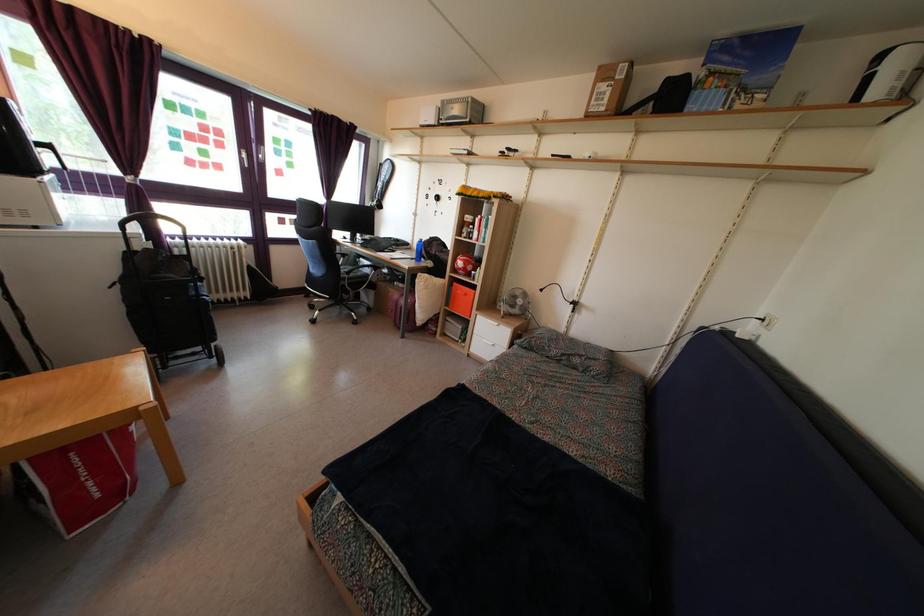
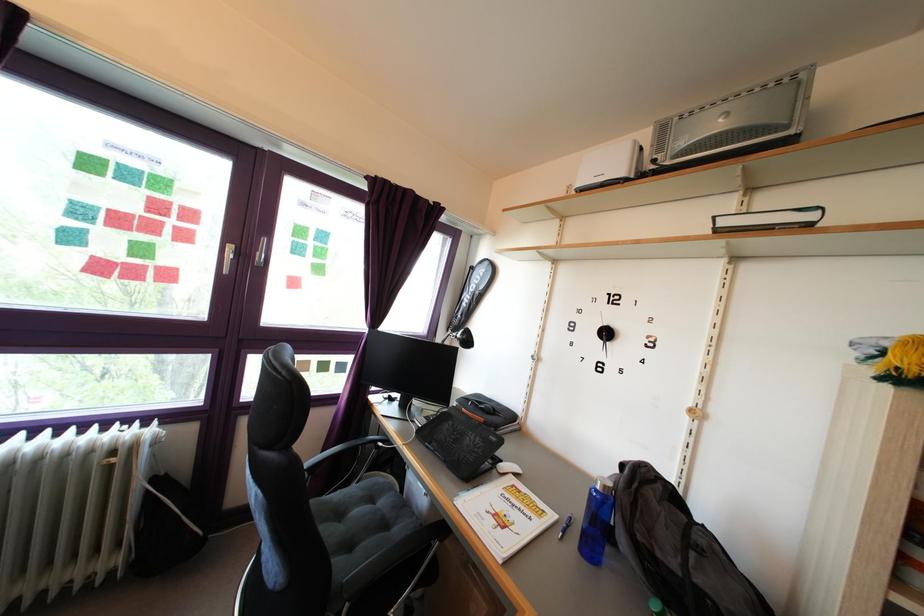
What movement of the cameraman would produce the second image?

The movement direction of the cameraman is left, forward.